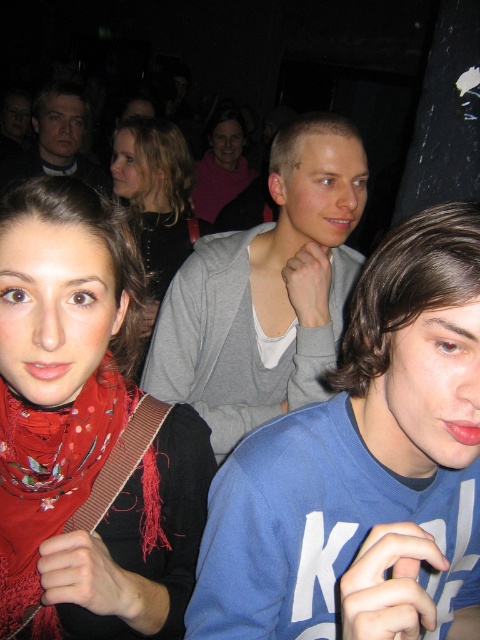
Is the position of red scarf at center less distant than that of matte pink sweater at center?

Yes, red scarf at center is closer to the viewer.

Who is shorter, red scarf at center or matte pink sweater at center?

Standing shorter between the two is red scarf at center.

Locate an element on the screen. This screenshot has width=480, height=640. red scarf at center is located at coordinates (85, 429).

Identify the location of red scarf at center. coord(85,429).

Can you confirm if blue cotton shirt at center is wider than blonde hair at center?

Yes, blue cotton shirt at center is wider than blonde hair at center.

Between blue cotton shirt at center and blonde hair at center, which one is positioned lower?

Positioned lower is blue cotton shirt at center.

Is point (290, 570) farther from viewer compared to point (147, 250)?

That is False.

The height and width of the screenshot is (640, 480). Identify the location of blue cotton shirt at center. (364, 468).

From the picture: Which of these two, blonde hair at center or matte gray sweater at center, stands shorter?

With less height is matte gray sweater at center.

Is blonde hair at center positioned before matte gray sweater at center?

That is True.

Is point (173, 256) closer to camera compared to point (32, 115)?

Yes, point (173, 256) is closer to viewer.

Where is `blonde hair at center`? This screenshot has width=480, height=640. blonde hair at center is located at coordinates (156, 202).